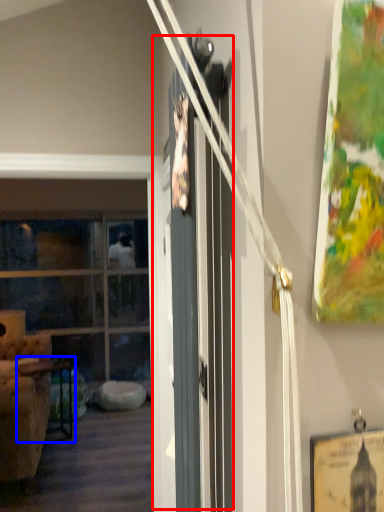
Question: Which point is further to the camera, barn door (highlighted by a red box) or table (highlighted by a blue box)?

Choices:
 (A) barn door
 (B) table

Answer: (B)